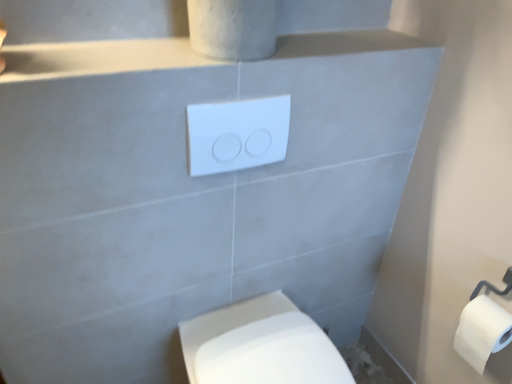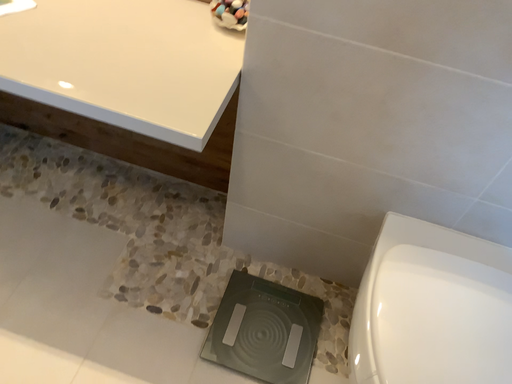
Question: Which way did the camera rotate in the video?

Choices:
 (A) rotated left
 (B) rotated right

Answer: (A)